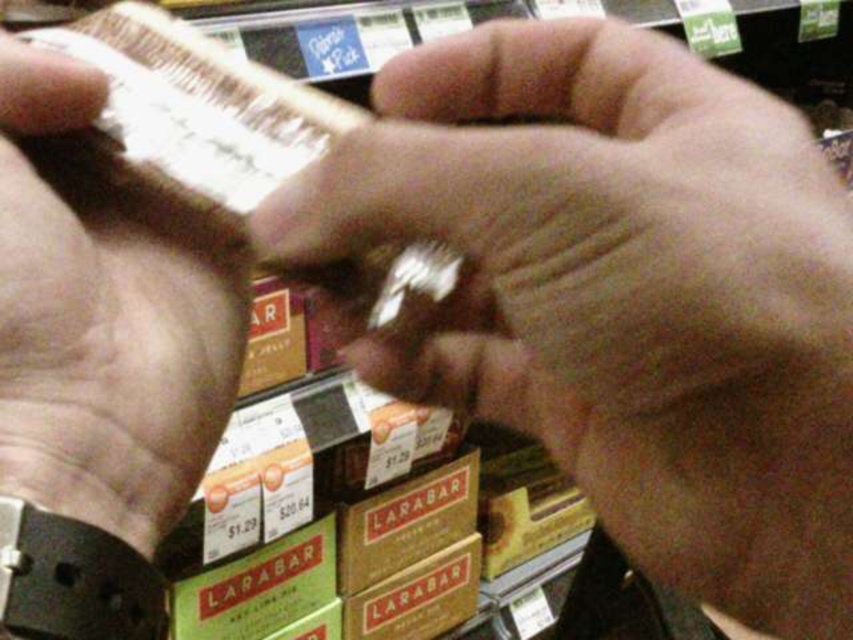
Question: Can you confirm if matte plastic hand at center is positioned above smooth brown leather wallet at left?

Choices:
 (A) no
 (B) yes

Answer: (B)

Question: Where is matte plastic hand at center located in relation to smooth brown leather wallet at left in the image?

Choices:
 (A) right
 (B) left

Answer: (A)

Question: Is matte plastic hand at center to the left of smooth brown leather wallet at left from the viewer's perspective?

Choices:
 (A) no
 (B) yes

Answer: (A)